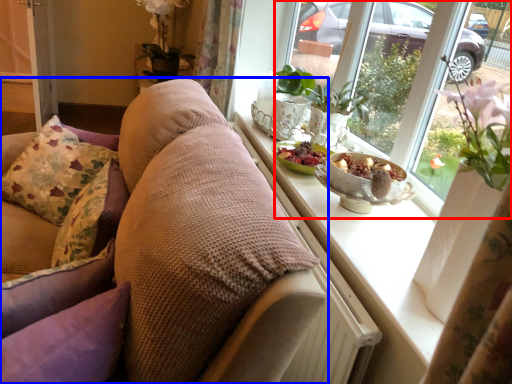
Question: Which object appears farthest to the camera in this image, window (highlighted by a red box) or studio couch (highlighted by a blue box)?

Choices:
 (A) window
 (B) studio couch

Answer: (A)